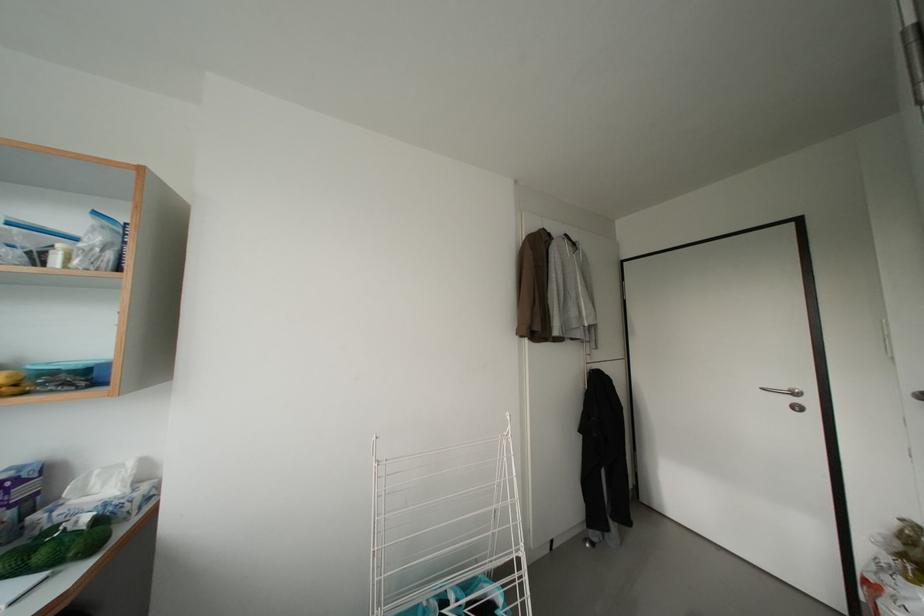
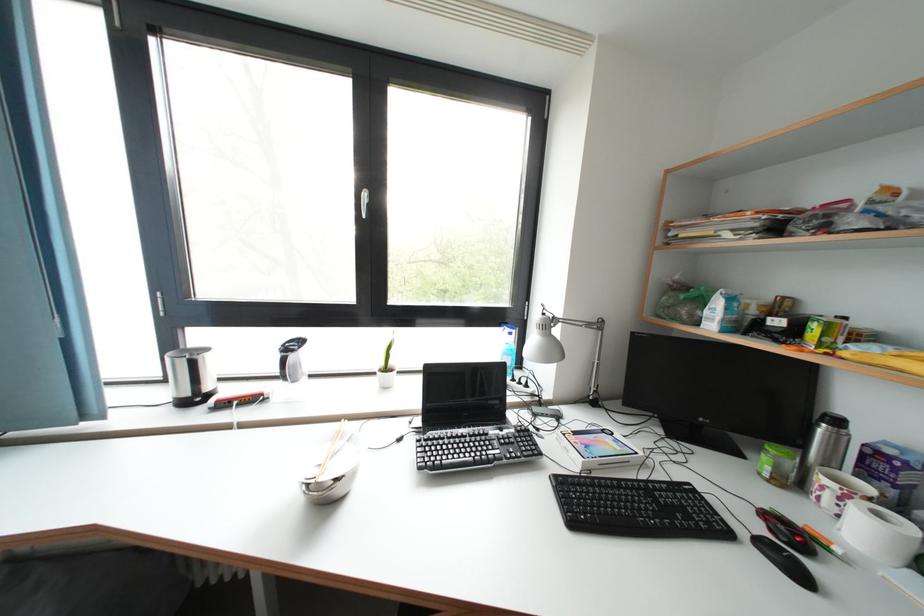
Question: The images are taken continuously from a first-person perspective. In which direction is your viewpoint rotating?

Choices:
 (A) Left
 (B) Right
 (C) Up
 (D) Down

Answer: (A)